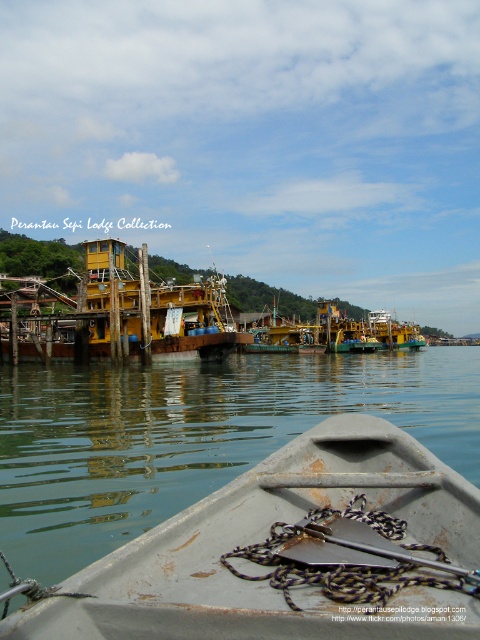
Question: Does gray metallic boat at lower center appear under yellow matte dock at center?

Choices:
 (A) no
 (B) yes

Answer: (B)

Question: Is yellow matte dock at center to the right of yellow matte boat at center from the viewer's perspective?

Choices:
 (A) yes
 (B) no

Answer: (B)

Question: Which object appears farthest from the camera in this image?

Choices:
 (A) yellow matte dock at center
 (B) gray metallic boat at lower center
 (C) yellow matte boat at center

Answer: (C)

Question: Is gray metallic boat at lower center smaller than yellow matte dock at center?

Choices:
 (A) no
 (B) yes

Answer: (B)

Question: Which point is farther to the camera?

Choices:
 (A) (176, 288)
 (B) (311, 340)
 (C) (41, 636)

Answer: (B)

Question: Among these points, which one is nearest to the camera?

Choices:
 (A) (276, 472)
 (B) (86, 253)
 (C) (284, 321)

Answer: (A)